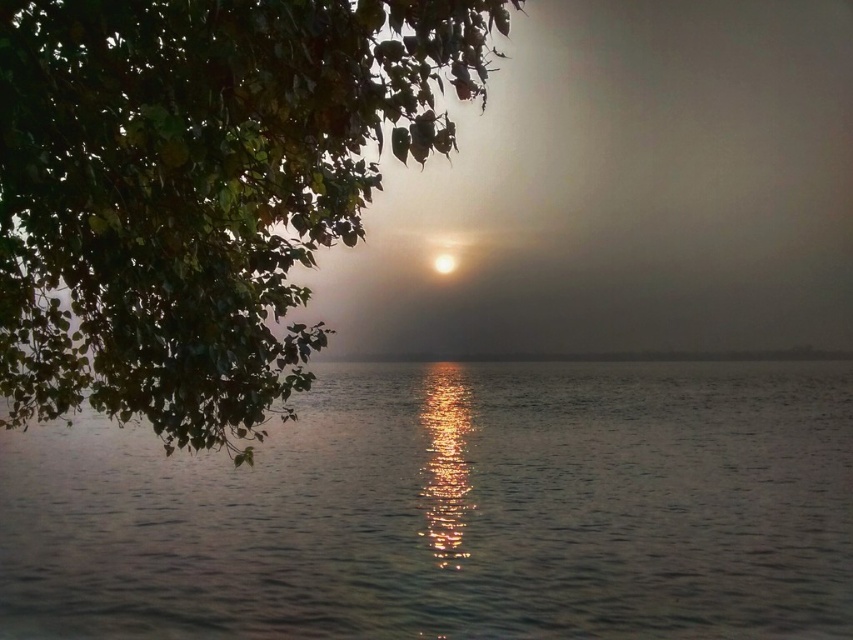
Is glistening silver water at center below bright white orb at center?

Indeed, glistening silver water at center is positioned under bright white orb at center.

Measure the distance from glistening silver water at center to bright white orb at center.

They are 5.96 meters apart.

The width and height of the screenshot is (853, 640). Describe the element at coordinates (454, 512) in the screenshot. I see `glistening silver water at center` at that location.

The width and height of the screenshot is (853, 640). Find the location of `glistening silver water at center`. glistening silver water at center is located at coordinates (454, 512).

Consider the image. Does green leafy tree at upper left lie behind bright white orb at center?

That is False.

Find the location of a particular element. Image resolution: width=853 pixels, height=640 pixels. green leafy tree at upper left is located at coordinates (201, 189).

Find the location of `green leafy tree at upper left`. green leafy tree at upper left is located at coordinates (201, 189).

In the scene shown: Does glistening silver water at center lie behind green leafy tree at upper left?

Yes, glistening silver water at center is further from the viewer.

Does glistening silver water at center appear over green leafy tree at upper left?

Incorrect, glistening silver water at center is not positioned above green leafy tree at upper left.

You are a GUI agent. You are given a task and a screenshot of the screen. Output one action in this format:
    pyautogui.click(x=<x>, y=<y>)
    Task: Click on the glistening silver water at center
    This screenshot has height=640, width=853.
    Given the screenshot: What is the action you would take?
    pyautogui.click(x=454, y=512)